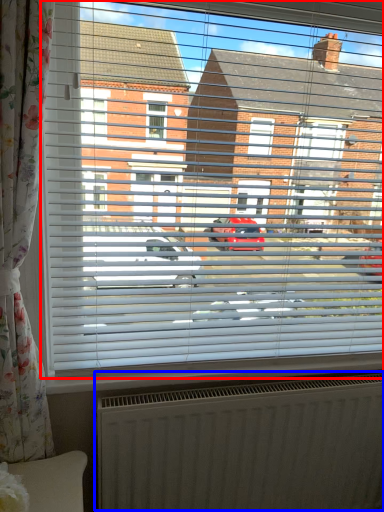
Question: Which object appears farthest to the camera in this image, window (highlighted by a red box) or radiator (highlighted by a blue box)?

Choices:
 (A) window
 (B) radiator

Answer: (B)